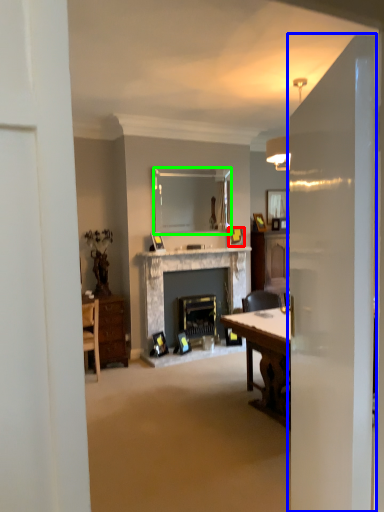
Question: Estimate the real-world distances between objects in this image. Which object is farther from picture frame (highlighted by a red box), glass door (highlighted by a blue box) or mirror (highlighted by a green box)?

Choices:
 (A) glass door
 (B) mirror

Answer: (A)